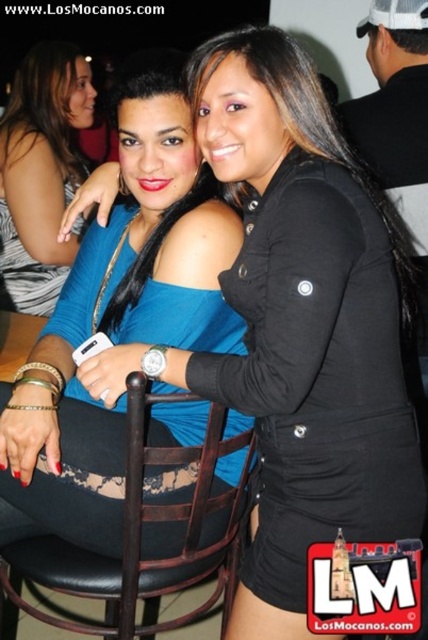
Question: Which point is farther to the camera?

Choices:
 (A) (152, 451)
 (B) (62, 209)
 (C) (56, 378)

Answer: (B)

Question: Can you confirm if black leather chair at center is positioned to the right of blue fabric top at center?

Choices:
 (A) no
 (B) yes

Answer: (B)

Question: Among these points, which one is farthest from the camera?

Choices:
 (A) (32, 60)
 (B) (0, 392)

Answer: (A)

Question: Is black leather chair at center further to the viewer compared to blue fabric top at center?

Choices:
 (A) no
 (B) yes

Answer: (A)

Question: Does blue matte dress at center have a larger size compared to black leather chair at center?

Choices:
 (A) no
 (B) yes

Answer: (B)

Question: Among these points, which one is farthest from the camera?

Choices:
 (A) (6, 582)
 (B) (76, 93)

Answer: (B)